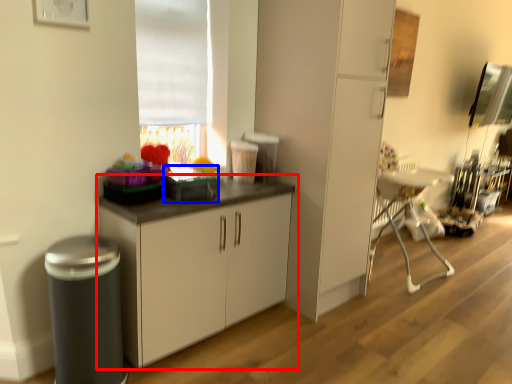
Question: Which point is closer to the camera, cabinetry (highlighted by a red box) or appliance (highlighted by a blue box)?

Choices:
 (A) cabinetry
 (B) appliance

Answer: (A)